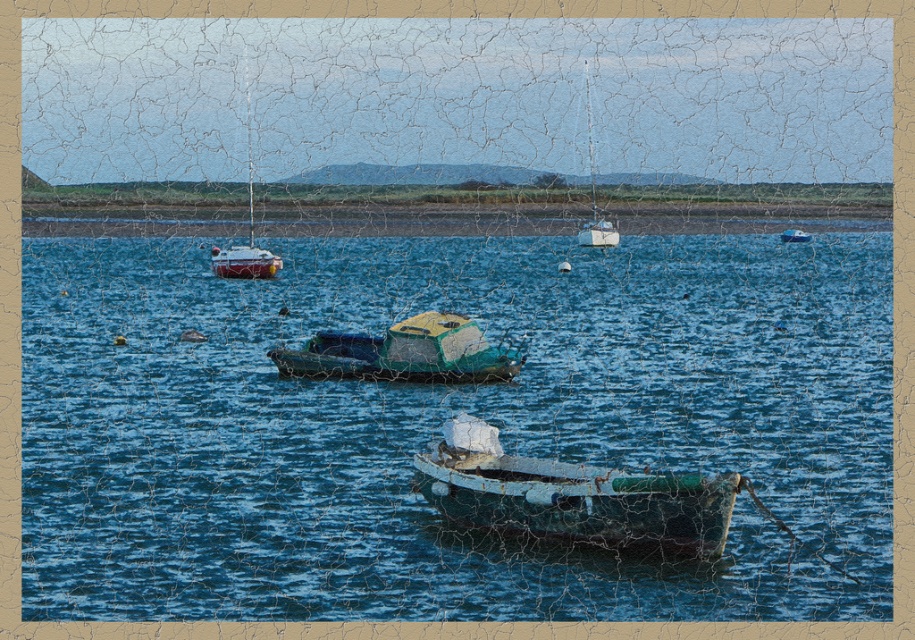
You are a sailor planning to dock your new boat at the center of the image. There are already two boats present, the rusty metal boat at center and the green matte boat at center. Considering the space between them, can you safely maneuver your boat to fit between them without colliding?

The distance between the rusty metal boat at center and the green matte boat at center is 11.65 meters. If your new boat is shorter than this distance, you can safely maneuver between them. However, if your boat is longer than 11.65 meters, it may not fit without collision.

You are standing on the shore and see the blue water at center and the white plastic boat at center. Which object is positioned more to the left?

The blue water at center is positioned to the left of the white plastic boat at center.